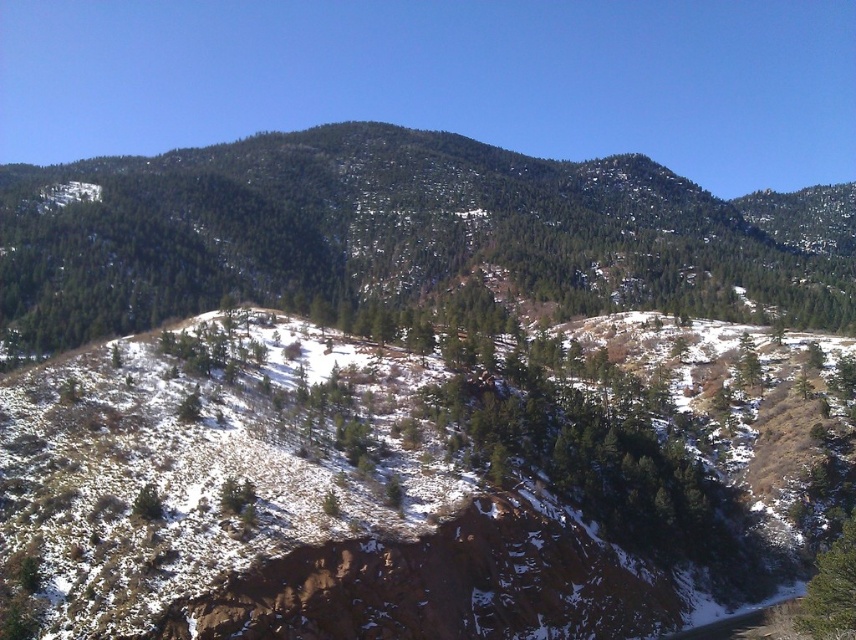
You are standing at the base of the mountain and want to reach the point marked at coordinates point (580,259). Given that the distance between you and that point is 805.64 feet, would you consider this a short hike or a long hike?

The distance between you and the point (580,259) is 805.64 feet. Considering typical hiking distances, this would be considered a short hike.

You are a hiker planning to climb the green textured hillside at center and the green matte tree at lower right. Which one would require more effort due to its height?

The green textured hillside at center requires more effort because it has a greater height compared to the green matte tree at lower right.

You are a hiker planning to traverse the mountainous landscape shown in the image. You need to reach a specific location marked by the point at coordinates (405,236). Based on the scene description, what type of terrain will you encounter at that point?

The terrain at point (405,236) is a green textured hillside at center, which is part of the mountainous landscape with vegetation consisting primarily of coniferous trees and some dry grass or shrubs.